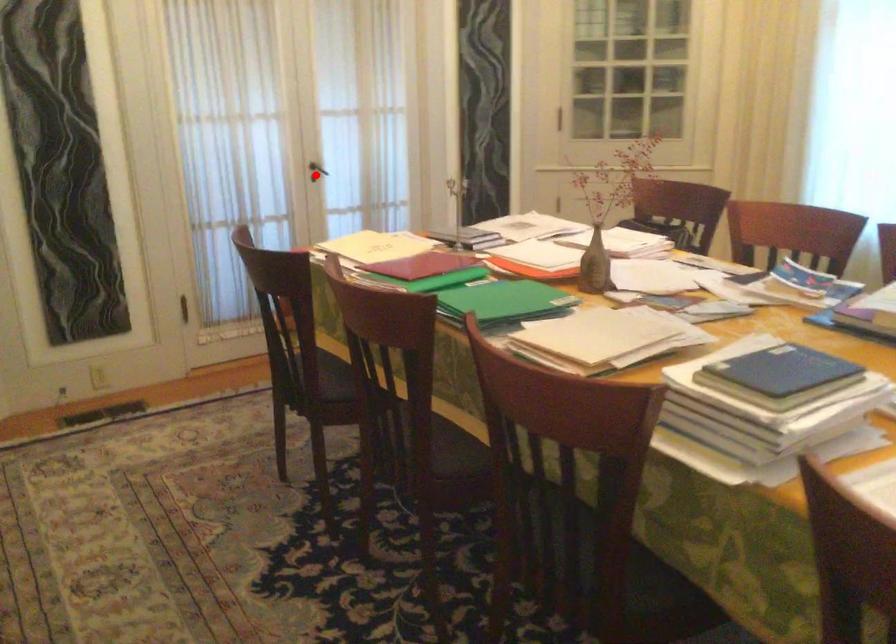
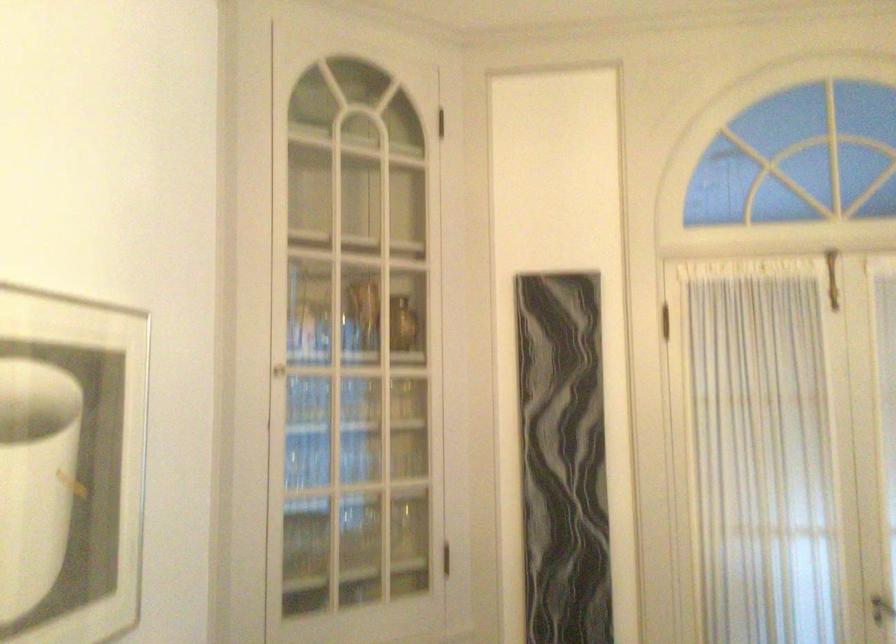
Question: I am providing you with two images of the same scene from different viewpoints. In image1, a red point is highlighted. Considering the same 3D point in image2, which of the following is correct?

Choices:
 (A) It is closer
 (B) It is farther

Answer: (A)